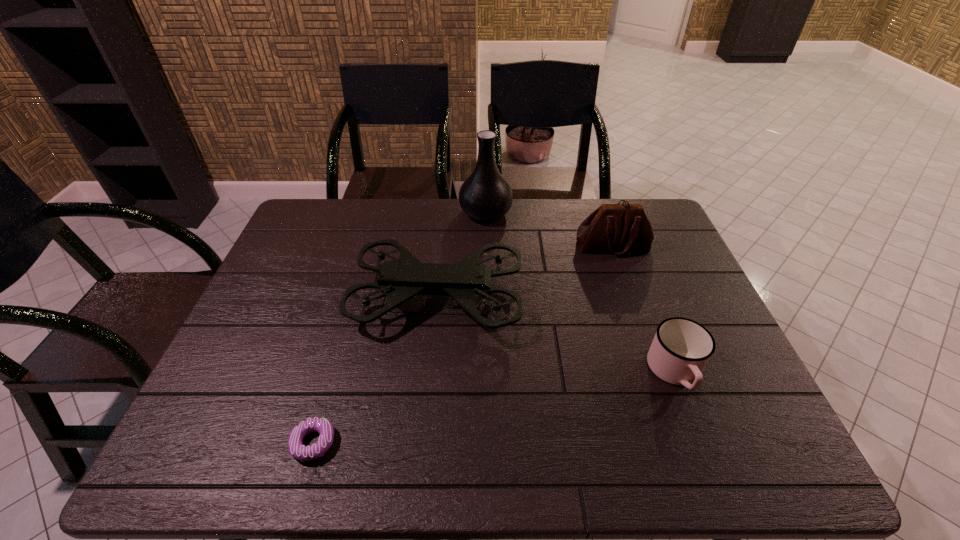
Locate an element on the screen. the tallest object is located at coordinates (485, 195).

Where is `the farthest object`? Image resolution: width=960 pixels, height=540 pixels. the farthest object is located at coordinates pos(485,195).

This screenshot has height=540, width=960. I want to click on the second tallest object, so click(467, 281).

Identify the location of the second farthest object. The width and height of the screenshot is (960, 540). (618, 228).

At what (x,y) coordinates should I click in order to perform the action: click on shoulder bag. Please return your answer as a coordinate pair (x, y). Image resolution: width=960 pixels, height=540 pixels. Looking at the image, I should click on (618, 228).

Find the location of a particular element. The image size is (960, 540). mug is located at coordinates (681, 348).

Locate an element on the screen. doughnut is located at coordinates (303, 453).

Identify the location of the nearest object. (303, 453).

At what (x,y) coordinates should I click in order to perform the action: click on vacant position located on the front of the tallest object. Please return your answer as a coordinate pair (x, y). Looking at the image, I should click on (488, 310).

The width and height of the screenshot is (960, 540). What are the coordinates of `vacant space located on the left of the fourth shortest object` in the screenshot? It's located at (264, 299).